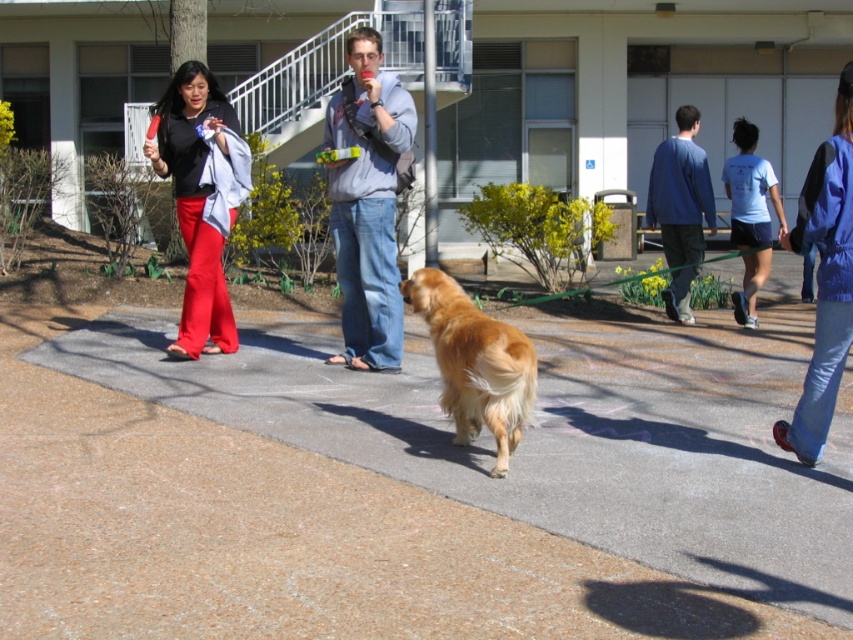
Question: Which of the following is the closest to the observer?

Choices:
 (A) golden fur dog at center
 (B) light gray sweatshirt at center

Answer: (A)

Question: Can you confirm if brown concrete pavement at center is smaller than blue fabric jacket at lower right?

Choices:
 (A) no
 (B) yes

Answer: (B)

Question: Can you confirm if blue cotton shirt at right is thinner than light blue t-shirt at center?

Choices:
 (A) yes
 (B) no

Answer: (B)

Question: Does light gray sweatshirt at center have a lesser width compared to blue cotton shirt at right?

Choices:
 (A) no
 (B) yes

Answer: (B)

Question: Which of the following is the farthest from the observer?

Choices:
 (A) (733, 202)
 (B) (503, 349)
 (C) (184, 216)
 (D) (392, 272)

Answer: (A)

Question: Among these points, which one is nearest to the camera?

Choices:
 (A) (659, 163)
 (B) (338, 355)
 (C) (204, 250)

Answer: (C)